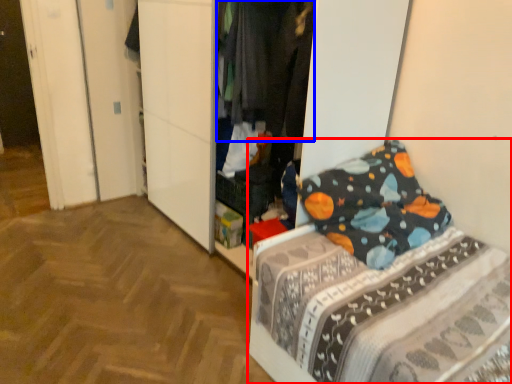
Question: Which object is further to the camera taking this photo, bed (highlighted by a red box) or clothing (highlighted by a blue box)?

Choices:
 (A) bed
 (B) clothing

Answer: (B)